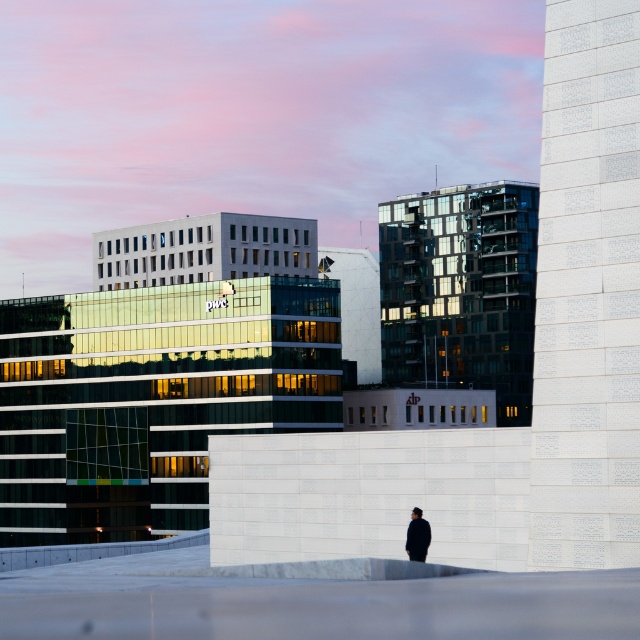
You are a drone operator who needs to fly a drone from your current position to the white textured wall at right. Given that the drone has a maximum flight range of 30 meters, can it reach the wall?

The distance between the white textured wall at right and the viewer is 33.73 meters, which exceeds the drone operator drone maximum flight range of 30 meters. Therefore, the drone cannot reach the wall.

You are a photographer planning to take a portrait of the person wearing the black matte jacket at center. The white textured wall at right is in the background. Based on the scene description, will the wall be taller than the person in the photo?

The white textured wall at right is taller than black matte jacket at center, so yes, the wall will be taller than the person in the photo.

You are a drone operator trying to deliver a package to the white textured wall at right. The delivery point is marked as point (588, 292). Can you confirm if this point is on the white textured wall at right?

Yes, the point (588, 292) is on the white textured wall at right as per the provided coordinates.